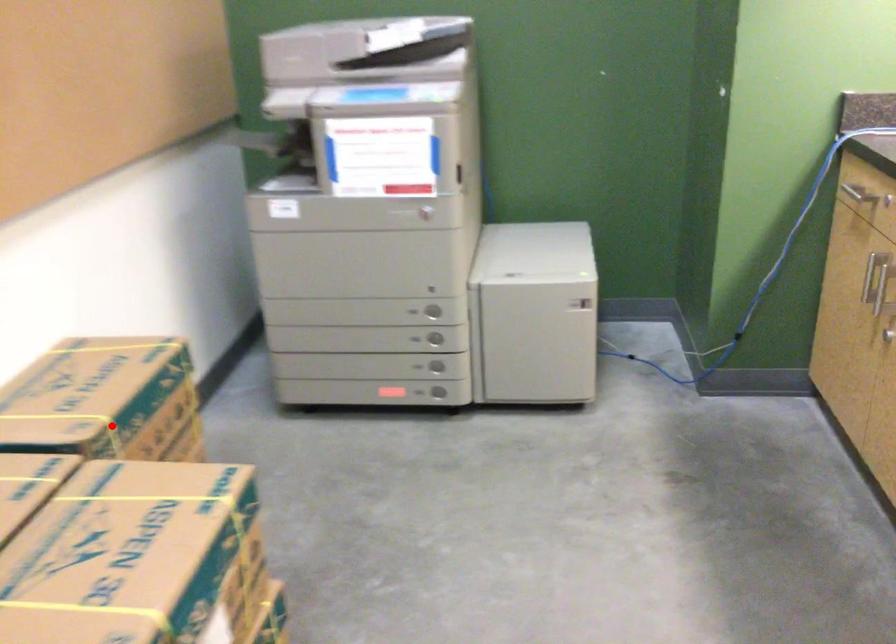
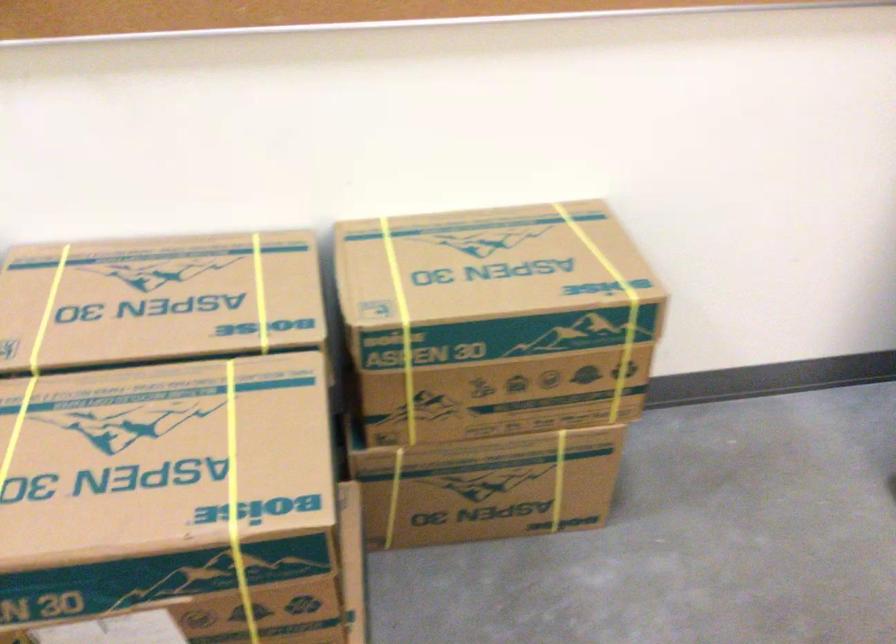
Question: I am providing you with two images of the same scene from different viewpoints. Given a red point in image1, look at the same physical point in image2. Is it:

Choices:
 (A) Closer to the viewpoint
 (B) Farther from the viewpoint

Answer: (A)